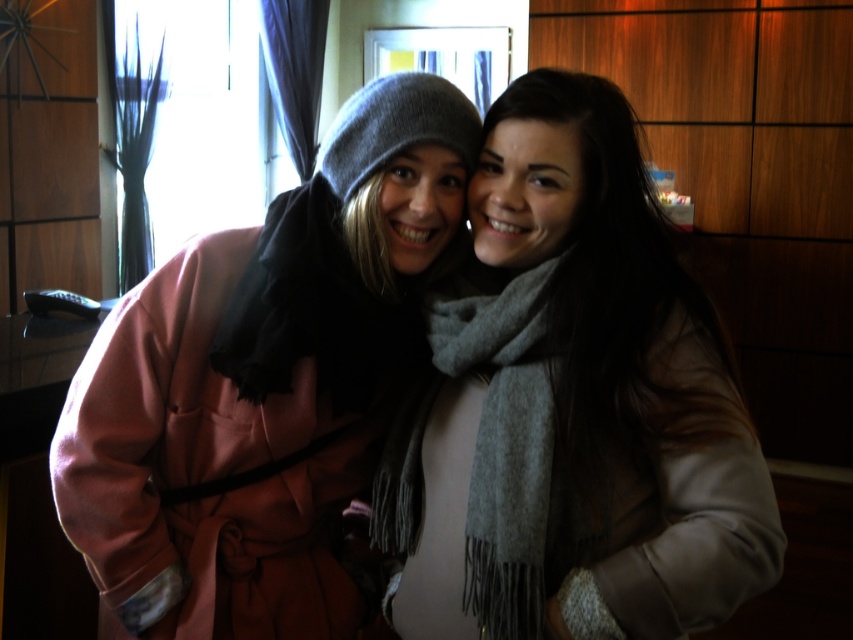
You are a photographer adjusting your camera settings. You notice the gray wool scarf at center in the image. Based on its position, can you determine if it will be in focus if you set the focus point at coordinates 0.6, 0.6?

The gray wool scarf at center is located at point [572,406], which is close to the focus point [511,384]. Therefore, it will likely be in focus.

You are a photographer setting up a shoot in a hotel room. You have a matte pink coat at left and a gray woolen scarf at center. You need to place a small prop between them. Which object should the prop be closer to to ensure it doesn

The matte pink coat at left is wider than the gray woolen scarf at center. Therefore, the prop should be placed closer to the gray woolen scarf at center to ensure it fits within the space between them.